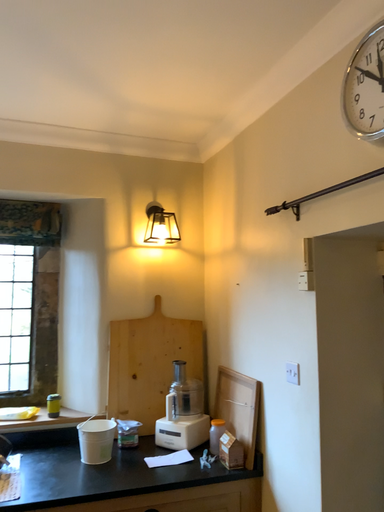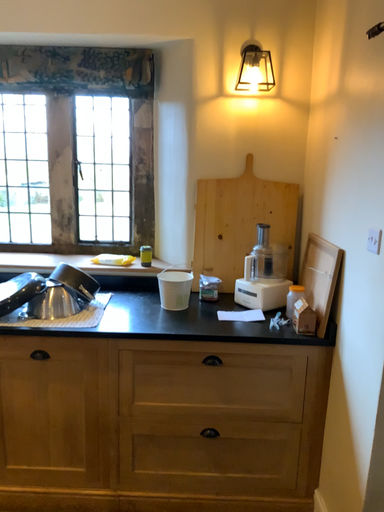
Question: How did the camera likely rotate when shooting the video?

Choices:
 (A) rotated right
 (B) rotated left

Answer: (B)